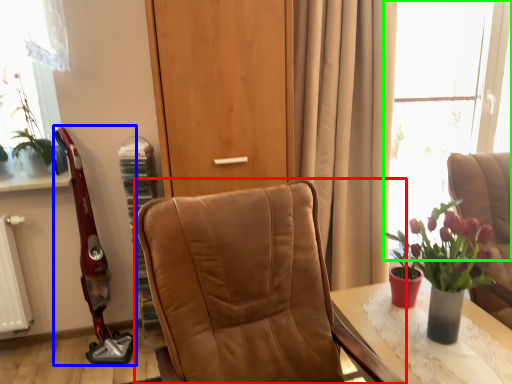
Question: Which object is positioned farthest from chair (highlighted by a red box)? Select from open (highlighted by a blue box) and window (highlighted by a green box).

Choices:
 (A) open
 (B) window

Answer: (B)